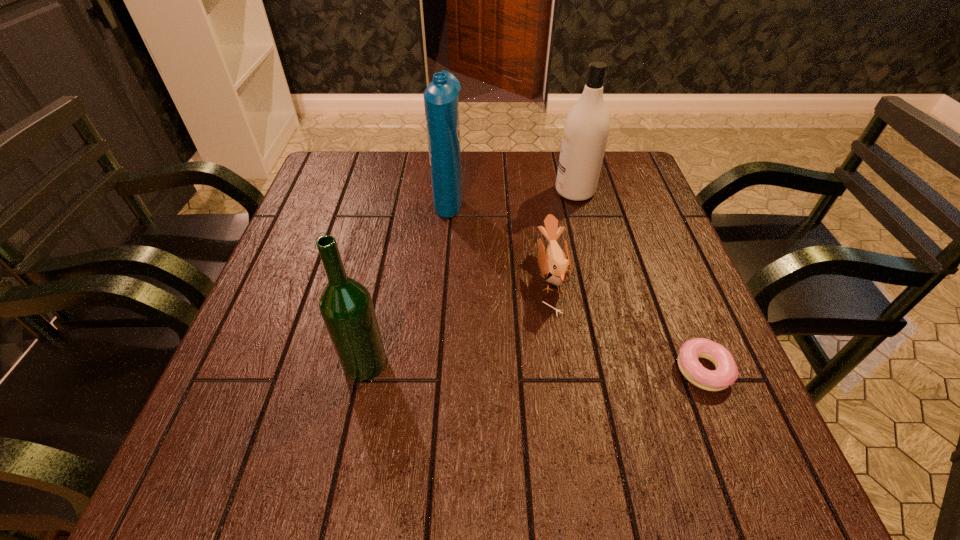
Locate an element on the screen. vacant space in between the bird and the rightmost object is located at coordinates (627, 323).

This screenshot has width=960, height=540. What are the coordinates of `free area in between the third object from right to left and the shortest object` in the screenshot? It's located at (627, 323).

Where is `free space between the alcohol and the shortest object`? The image size is (960, 540). free space between the alcohol and the shortest object is located at coordinates (534, 367).

At what (x,y) coordinates should I click in order to perform the action: click on vacant point located between the fourth object from right to left and the rightmost object. Please return your answer as a coordinate pair (x, y). Looking at the image, I should click on (576, 284).

Where is `the closest object to the fourth tallest object`? This screenshot has width=960, height=540. the closest object to the fourth tallest object is located at coordinates (586, 128).

At what (x,y) coordinates should I click in order to perform the action: click on object that stands as the third closest to the fourth object from right to left. Please return your answer as a coordinate pair (x, y). Looking at the image, I should click on (346, 306).

The image size is (960, 540). What are the coordinates of `blank space that satisfies the following two spatial constraints: 1. on the front-facing side of the second object from right to left; 2. on the right side of the doughnut` in the screenshot? It's located at (621, 370).

Where is `free space that satisfies the following two spatial constraints: 1. at the beak of the third object from left to right; 2. on the front side of the leftmost object`? The width and height of the screenshot is (960, 540). free space that satisfies the following two spatial constraints: 1. at the beak of the third object from left to right; 2. on the front side of the leftmost object is located at coordinates (564, 363).

Image resolution: width=960 pixels, height=540 pixels. In order to click on free space that satisfies the following two spatial constraints: 1. on the front side of the shortest object; 2. on the left side of the alcohol in this screenshot , I will do `click(363, 370)`.

Identify the location of free space that satisfies the following two spatial constraints: 1. on the front-facing side of the rightmost object; 2. on the right side of the right shampoo. (621, 370).